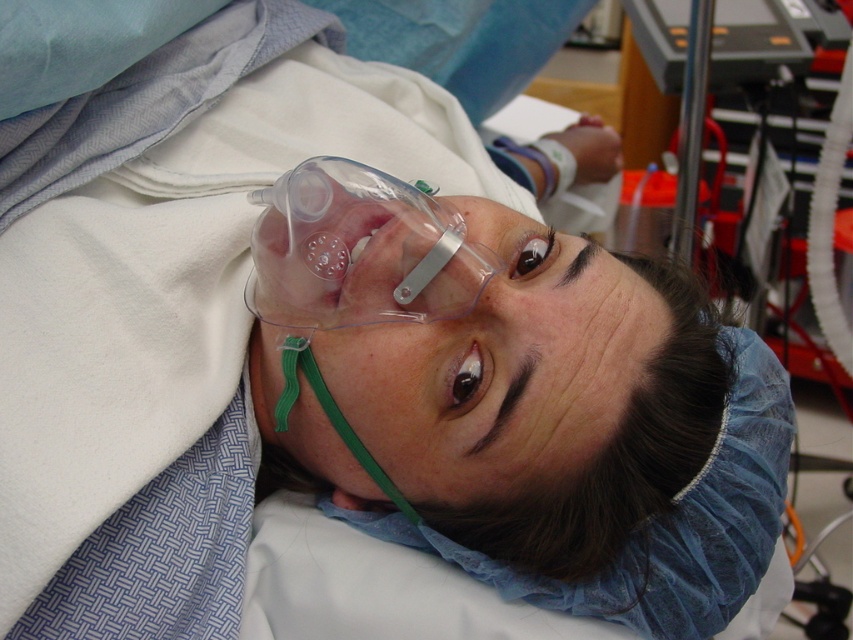
Based on the scene description, what object is located at the coordinates point (358, 250)?

The point (358, 250) indicates the transparent plastic mask at center.

You are a nurse checking the medical equipment in the room. The transparent plastic mask at center needs to be replaced with a larger one. Is the metallic silver oxygen tank at upper right wide enough to accommodate the new mask?

The transparent plastic mask at center is narrower than the metallic silver oxygen tank at upper right, so the new mask may fit as long as its width does not exceed the tank.